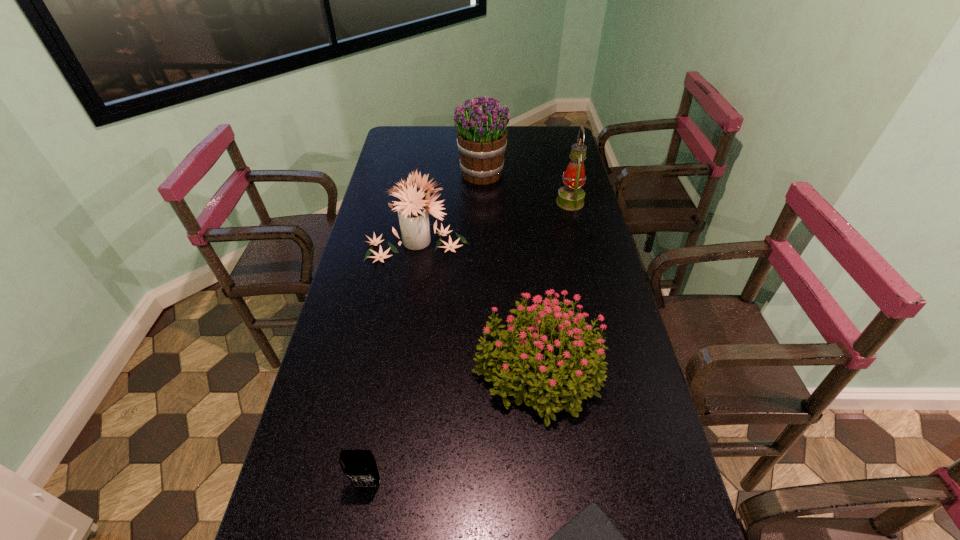
The image size is (960, 540). I want to click on blank space that satisfies the following two spatial constraints: 1. on the front side of the third nearest object; 2. on the left side of the farthest bouquet, so click(x=483, y=368).

Locate an element on the screen. vacant area in the image that satisfies the following two spatial constraints: 1. on the front side of the oil lamp; 2. on the right side of the tallest bouquet is located at coordinates (482, 202).